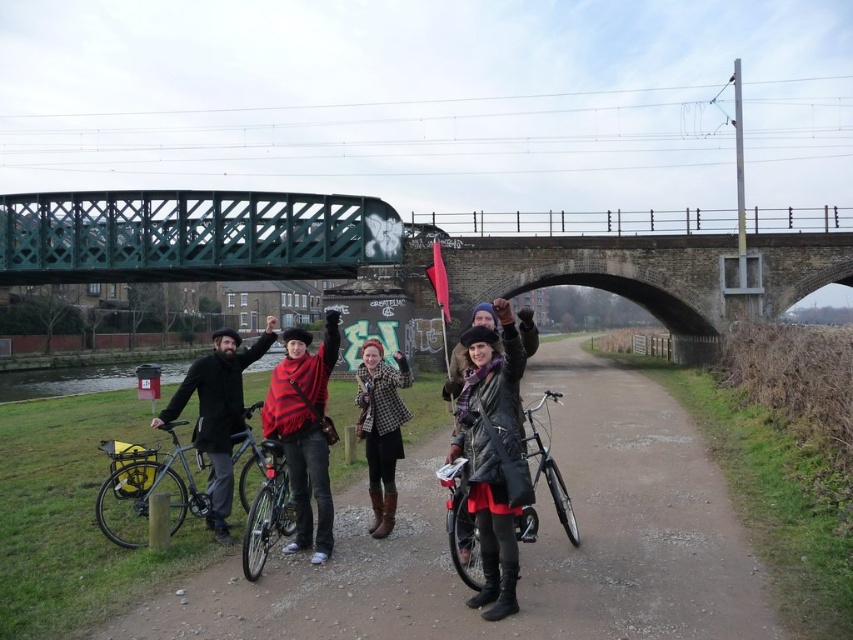
Question: Does dirt path at center lie in front of stone arch bridge at center?

Choices:
 (A) yes
 (B) no

Answer: (A)

Question: Which object is the farthest from the leather jacket at center?

Choices:
 (A) shiny metallic bicycle at center
 (B) dirt path at center

Answer: (A)

Question: Is green metal bridge at upper center to the left of silver metallic bicycle at lower left from the viewer's perspective?

Choices:
 (A) yes
 (B) no

Answer: (A)

Question: Which of the following is the farthest from the observer?

Choices:
 (A) red knitted scarf at center
 (B) shiny metallic bicycle at center

Answer: (A)

Question: Can you confirm if dirt path at center is smaller than leather jacket at center?

Choices:
 (A) yes
 (B) no

Answer: (B)

Question: Which of the following is the closest to the observer?

Choices:
 (A) (451, 550)
 (B) (548, 588)

Answer: (B)